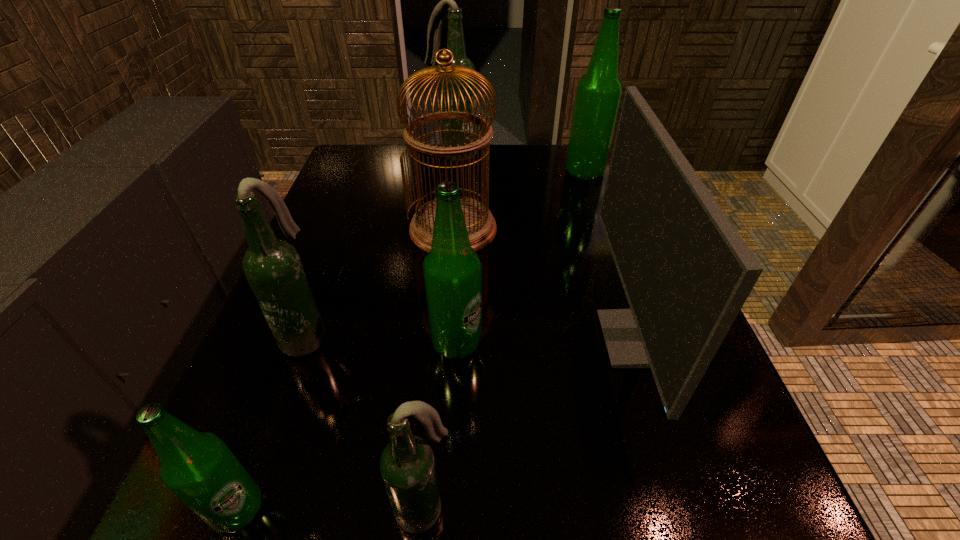
Identify which object is the fifth nearest to the leftmost green beer bottle. Please provide its 2D coordinates. Your answer should be formatted as a tuple, i.e. [(x, y)], where the tuple contains the x and y coordinates of a point satisfying the conditions above.

[(686, 272)]

The height and width of the screenshot is (540, 960). Identify the location of object that is the closest one to the computer monitor. (481, 226).

This screenshot has height=540, width=960. Find the location of `beer bottle that is the third closest to the second biggest green beer bottle`. beer bottle that is the third closest to the second biggest green beer bottle is located at coordinates (197, 467).

Identify which beer bottle is located as the nearest to the biggest green beer bottle. Please provide its 2D coordinates. Your answer should be formatted as a tuple, i.e. [(x, y)], where the tuple contains the x and y coordinates of a point satisfying the conditions above.

[(455, 40)]

Where is `dark beer bottle that is the nearest to the sixth nearest object`? Image resolution: width=960 pixels, height=540 pixels. dark beer bottle that is the nearest to the sixth nearest object is located at coordinates (272, 267).

Locate an element on the screen. This screenshot has height=540, width=960. the closest dark beer bottle relative to the computer monitor is located at coordinates (407, 465).

Locate which green beer bottle ranks third in proximity to the computer monitor. Please provide its 2D coordinates. Your answer should be formatted as a tuple, i.e. [(x, y)], where the tuple contains the x and y coordinates of a point satisfying the conditions above.

[(197, 467)]

Identify which green beer bottle is the second closest to the nearest dark beer bottle. Please provide its 2D coordinates. Your answer should be formatted as a tuple, i.e. [(x, y)], where the tuple contains the x and y coordinates of a point satisfying the conditions above.

[(452, 270)]

At what (x,y) coordinates should I click in order to perform the action: click on vacant point that satisfies the following two spatial constraints: 1. on the label of the biggest green beer bottle; 2. on the front-facing side of the third farthest object. Please return your answer as a coordinate pair (x, y). The image size is (960, 540). Looking at the image, I should click on (604, 230).

What are the coordinates of `free space that satisfies the following two spatial constraints: 1. on the label of the rightmost beer bottle; 2. on the front-facing side of the birdcage` in the screenshot? It's located at (604, 230).